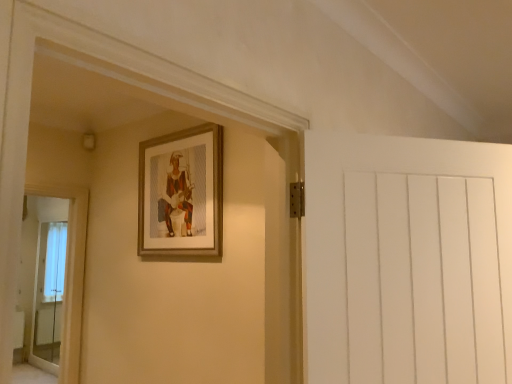
Image resolution: width=512 pixels, height=384 pixels. Identify the location of wooden framed artwork at upper center. (181, 193).

Describe the element at coordinates (181, 193) in the screenshot. I see `wooden framed artwork at upper center` at that location.

Identify the location of wooden framed artwork at upper center. This screenshot has width=512, height=384. (181, 193).